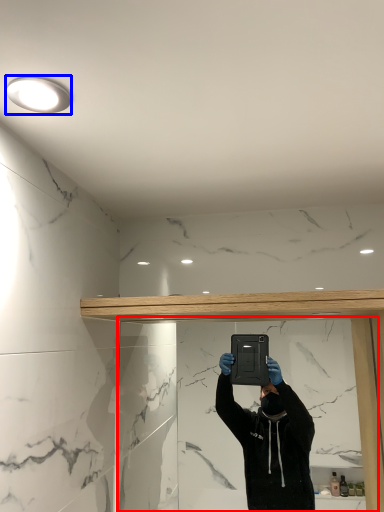
Question: Which point is further to the camera, mirror (highlighted by a red box) or light fixture (highlighted by a blue box)?

Choices:
 (A) mirror
 (B) light fixture

Answer: (A)